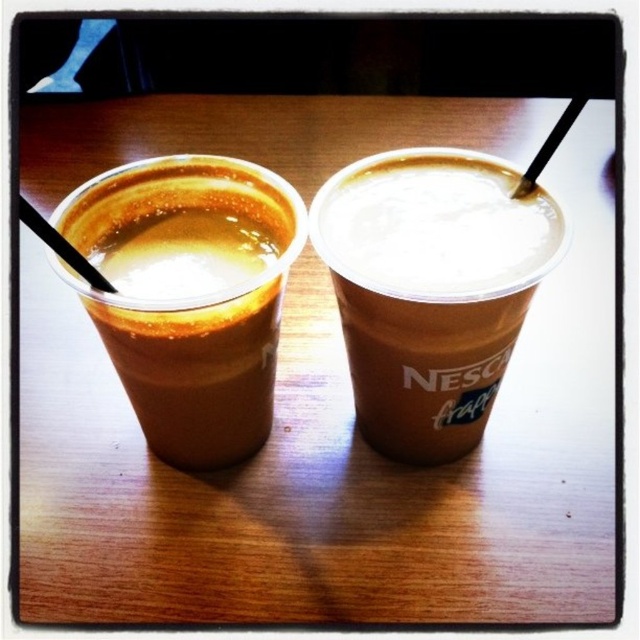
Question: Does brown matte cup at left appear under black plastic straw at left?

Choices:
 (A) yes
 (B) no

Answer: (A)

Question: Estimate the real-world distances between objects in this image. Which object is farther from the white frothy nescafé frappé at center?

Choices:
 (A) black plastic straw at left
 (B) brown matte cup at left

Answer: (A)

Question: Which object is the closest to the black plastic straw at left?

Choices:
 (A) white frothy nescafé frappé at center
 (B) brown matte cup at left

Answer: (B)

Question: Based on their relative distances, which object is nearer to the black plastic straw at left?

Choices:
 (A) white frothy nescafé frappé at center
 (B) brown matte cup at left
 (C) black plastic straw at upper right

Answer: (B)

Question: Does brown matte cup at left appear under black plastic straw at left?

Choices:
 (A) yes
 (B) no

Answer: (A)

Question: Can you confirm if black plastic straw at left is positioned to the left of black plastic straw at upper right?

Choices:
 (A) no
 (B) yes

Answer: (B)